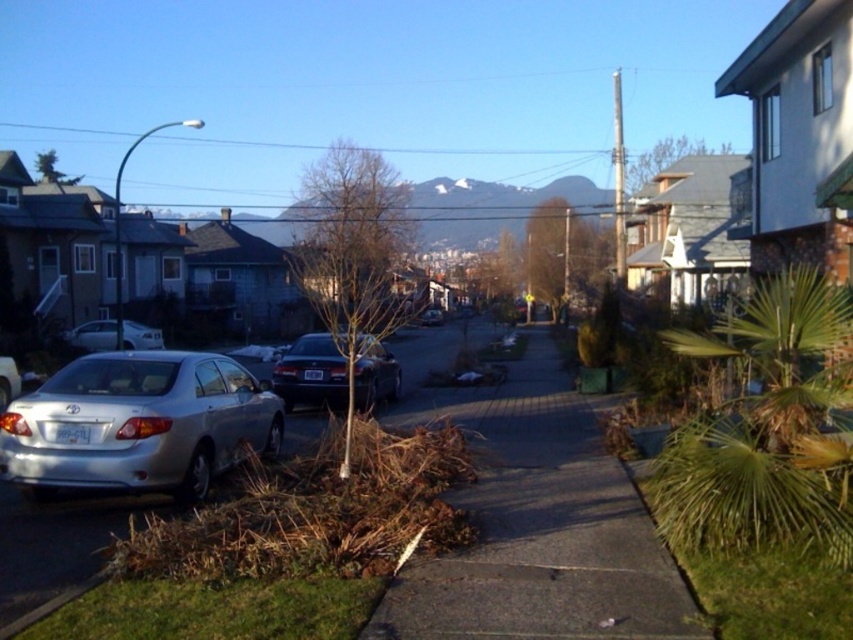
Question: Does concrete sidewalk at center have a larger size compared to satin silver sedan at left?

Choices:
 (A) no
 (B) yes

Answer: (B)

Question: Which is farther from the shiny black sedan at center?

Choices:
 (A) satin black sedan at center
 (B) satin silver sedan at left

Answer: (A)

Question: Is brown dry wood at lower left bigger than satin black sedan at center?

Choices:
 (A) no
 (B) yes

Answer: (A)

Question: Which object is positioned farthest from the satin silver sedan at left?

Choices:
 (A) satin black sedan at center
 (B) silver metallic sedan at lower left

Answer: (A)

Question: Can you confirm if brown dry wood at lower left is bigger than satin black sedan at center?

Choices:
 (A) yes
 (B) no

Answer: (B)

Question: Which object appears farthest from the camera in this image?

Choices:
 (A) concrete sidewalk at center
 (B) shiny black sedan at center

Answer: (B)